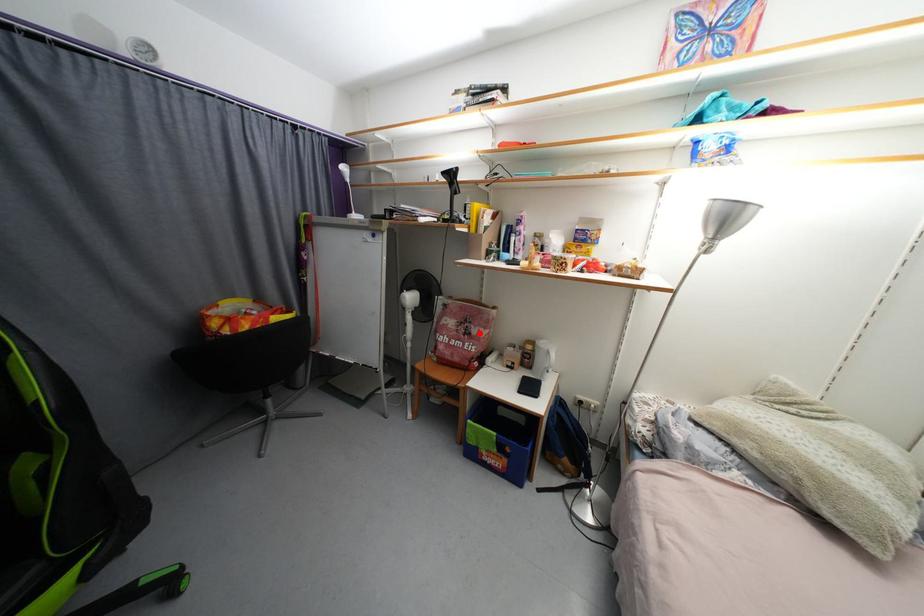
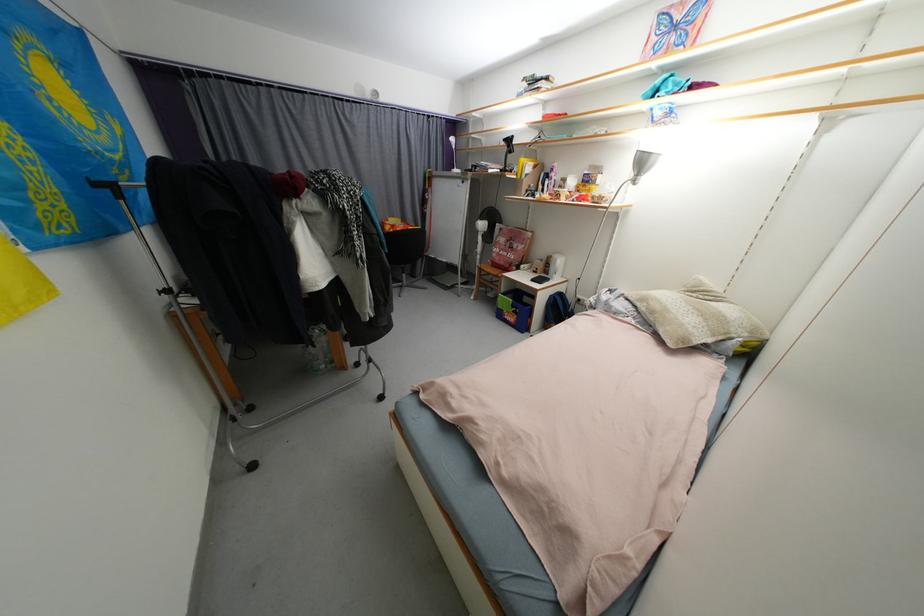
Find the pixel in the second image that matches the highlighted location in the first image.

(520, 248)